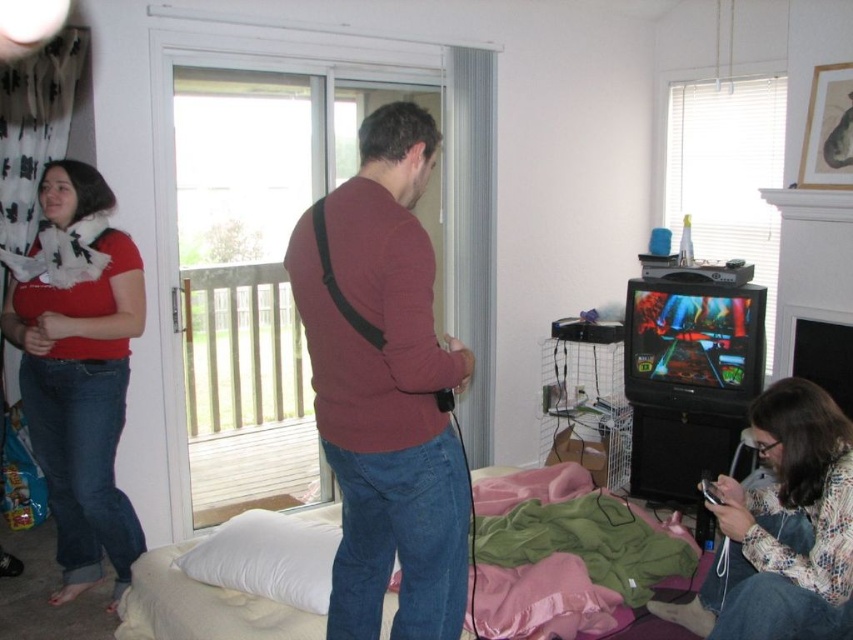
You are a delivery person who needs to place a small package between the maroon sweater at center and the floral print sweater at lower right. Can you fit the package in the space between them if the package is 36 inches long?

The maroon sweater at center and floral print sweater at lower right are 38.85 inches apart, so the 36 inches long package can fit between them since it is shorter than the available space.

You are organizing a charity clothing drive and need to determine which items can fit into a donation box that has a minimum size requirement of 30x30 cm. Given the descriptions of the matte red sweater at left and the floral print sweater at lower right, which one is more likely to meet the size requirement?

The matte red sweater at left is larger in size than the floral print sweater at lower right, so it is more likely to meet the 30x30 cm size requirement for the donation box.